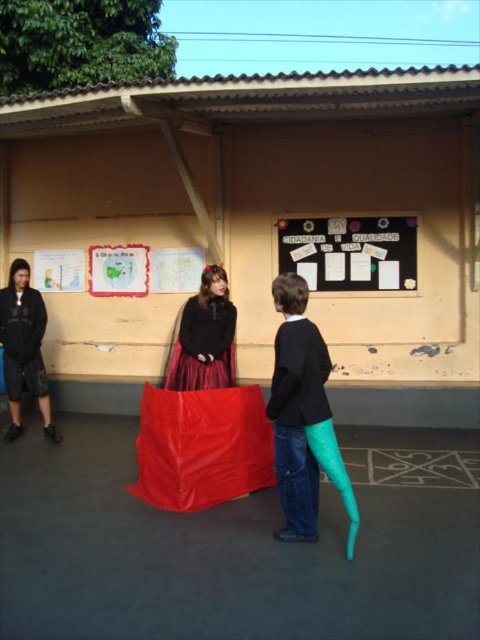
Question: Considering the real-world distances, which object is closest to the teal fabric tail at center?

Choices:
 (A) black matte jacket at left
 (B) red tarpaulin at center
 (C) matte black sweater at center

Answer: (C)

Question: Is black matte bulletin board at upper center to the right of matte black sweater at center from the viewer's perspective?

Choices:
 (A) no
 (B) yes

Answer: (B)

Question: Which object appears closest to the camera in this image?

Choices:
 (A) black matte jacket at left
 (B) matte black sweater at center

Answer: (B)

Question: Which point is farther to the camera?

Choices:
 (A) black matte bulletin board at upper center
 (B) teal fabric tail at center
 (C) black matte jacket at left
 (D) matte black sweater at center

Answer: (A)

Question: Does red tarpaulin at center have a lesser width compared to black matte jacket at left?

Choices:
 (A) yes
 (B) no

Answer: (A)

Question: Observing the image, what is the correct spatial positioning of black matte bulletin board at upper center in reference to matte black sweater at center?

Choices:
 (A) right
 (B) left

Answer: (A)